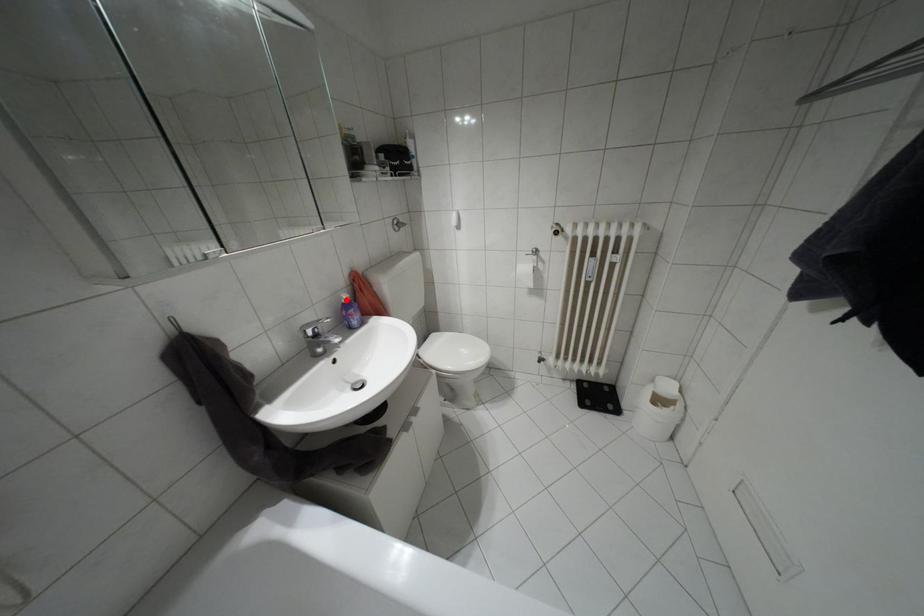
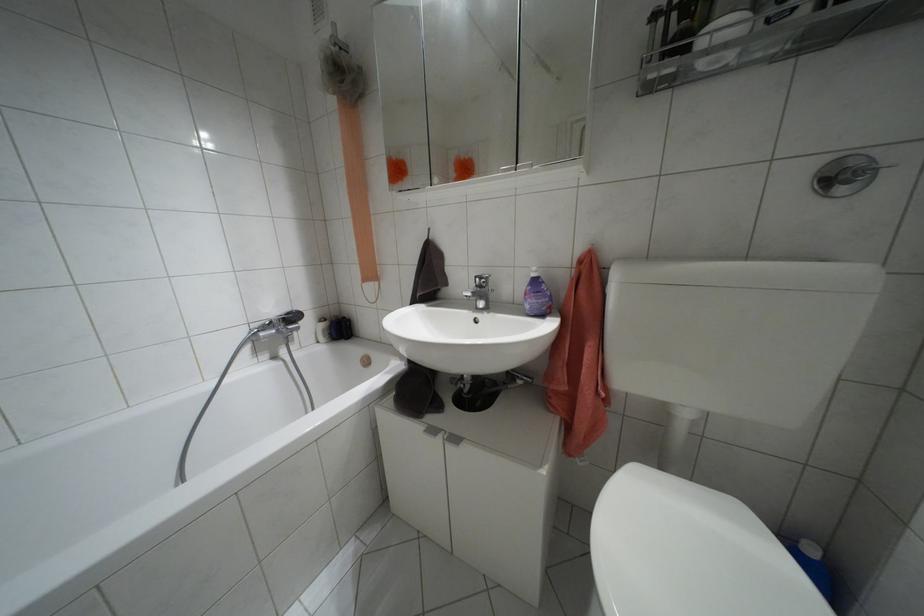
Locate, in the second image, the point that corresponds to the highlighted location in the first image.

(532, 274)